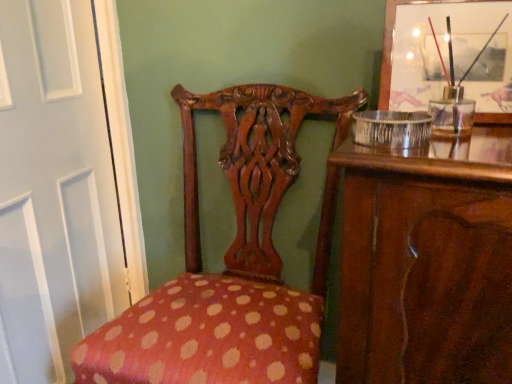
Question: Is white glossy door at left outside of polka dot fabric chair at center?

Choices:
 (A) yes
 (B) no

Answer: (A)

Question: From a real-world perspective, does white glossy door at left stand above polka dot fabric chair at center?

Choices:
 (A) yes
 (B) no

Answer: (A)

Question: Does white glossy door at left have a smaller size compared to polka dot fabric chair at center?

Choices:
 (A) yes
 (B) no

Answer: (A)

Question: Does white glossy door at left appear on the right side of polka dot fabric chair at center?

Choices:
 (A) no
 (B) yes

Answer: (A)

Question: Does white glossy door at left have a greater width compared to polka dot fabric chair at center?

Choices:
 (A) no
 (B) yes

Answer: (A)

Question: From the image's perspective, is white glossy door at left above polka dot fabric chair at center?

Choices:
 (A) no
 (B) yes

Answer: (B)

Question: Considering the relative positions of wooden picture frame at upper right and polka dot fabric chair at center in the image provided, is wooden picture frame at upper right to the left of polka dot fabric chair at center from the viewer's perspective?

Choices:
 (A) yes
 (B) no

Answer: (B)

Question: Is wooden picture frame at upper right closer to the viewer compared to polka dot fabric chair at center?

Choices:
 (A) yes
 (B) no

Answer: (B)

Question: Considering the relative positions of wooden picture frame at upper right and polka dot fabric chair at center in the image provided, is wooden picture frame at upper right to the right of polka dot fabric chair at center from the viewer's perspective?

Choices:
 (A) yes
 (B) no

Answer: (A)

Question: Is wooden picture frame at upper right not near polka dot fabric chair at center?

Choices:
 (A) no
 (B) yes

Answer: (A)

Question: Can we say wooden picture frame at upper right lies outside polka dot fabric chair at center?

Choices:
 (A) no
 (B) yes

Answer: (B)

Question: Is wooden picture frame at upper right thinner than polka dot fabric chair at center?

Choices:
 (A) yes
 (B) no

Answer: (A)

Question: Is white glossy door at left far from wooden picture frame at upper right?

Choices:
 (A) yes
 (B) no

Answer: (B)